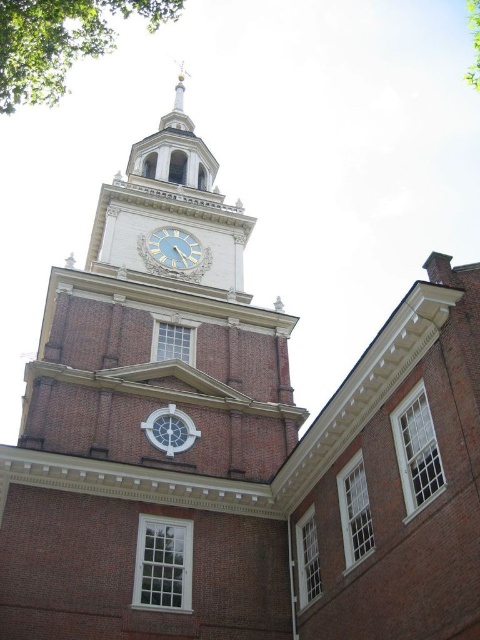
Is green leafy tree at upper left further to camera compared to green leafy tree at upper right?

No, green leafy tree at upper left is in front of green leafy tree at upper right.

Is green leafy tree at upper left smaller than green leafy tree at upper right?

Actually, green leafy tree at upper left might be larger than green leafy tree at upper right.

Find the location of `green leafy tree at upper left`. green leafy tree at upper left is located at coordinates (60, 42).

Between gold-toned metal clock at center and green leafy tree at upper right, which one has less height?

With less height is gold-toned metal clock at center.

Who is more distant from viewer, (x=188, y=266) or (x=472, y=26)?

Point (x=472, y=26)

Locate an element on the screen. The image size is (480, 640). gold-toned metal clock at center is located at coordinates point(175,248).

How distant is green leafy tree at upper left from gold-toned metal clock at center?

A distance of 27.71 meters exists between green leafy tree at upper left and gold-toned metal clock at center.

Can you confirm if green leafy tree at upper left is taller than gold-toned metal clock at center?

Correct, green leafy tree at upper left is much taller as gold-toned metal clock at center.

Between point (21, 4) and point (177, 236), which one is positioned behind?

Positioned behind is point (177, 236).

You are a GUI agent. You are given a task and a screenshot of the screen. Output one action in this format:
    pyautogui.click(x=<x>, y=<y>)
    Task: Click on the green leafy tree at upper left
    This screenshot has width=480, height=640.
    Given the screenshot: What is the action you would take?
    pyautogui.click(x=60, y=42)